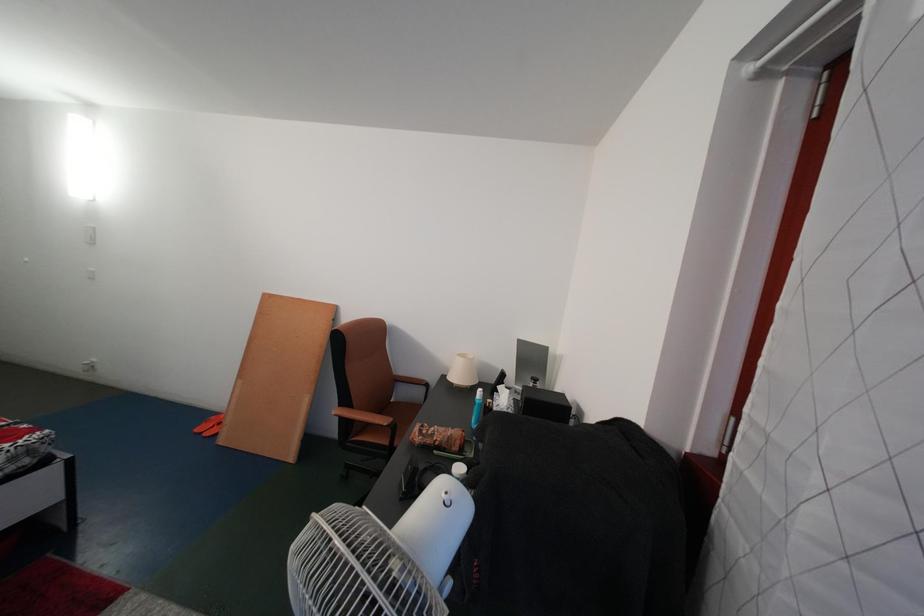
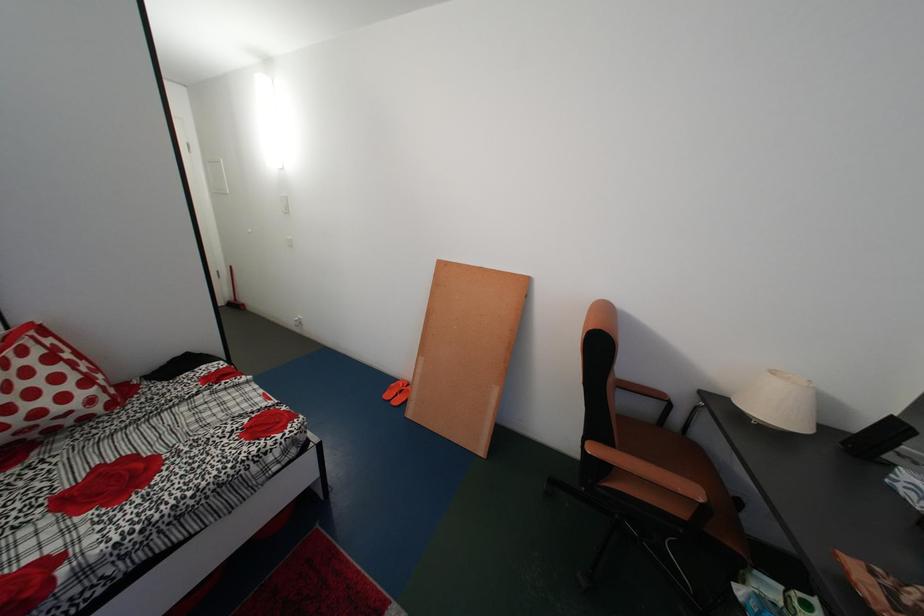
Which direction would the cameraman need to move to produce the second image?

The cameraman walked toward left, forward.